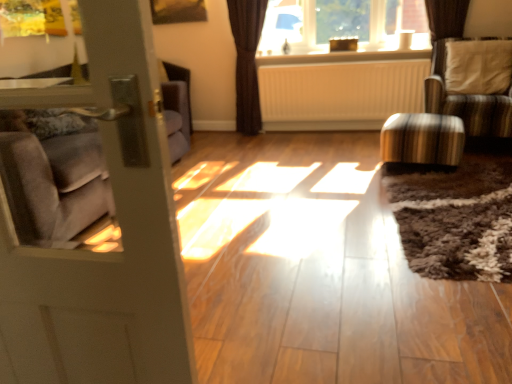
You are a GUI agent. You are given a task and a screenshot of the screen. Output one action in this format:
    pyautogui.click(x=<x>, y=<y>)
    Task: Click on the free space that is in between brown textured curtain at upper center and white matte radiator at center
    Image resolution: width=512 pixels, height=384 pixels.
    Given the screenshot: What is the action you would take?
    pyautogui.click(x=322, y=132)